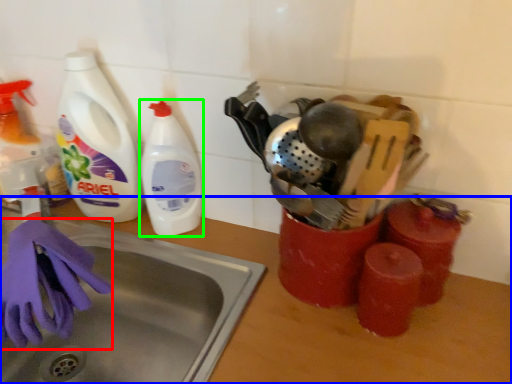
Question: Based on their relative distances, which object is farther from glove (highlighted by a red box)? Choose from counter top (highlighted by a blue box) and cleaning product (highlighted by a green box).

Choices:
 (A) counter top
 (B) cleaning product

Answer: (A)